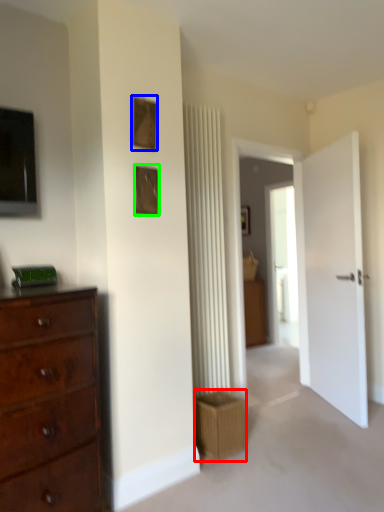
Question: Which object is positioned closest to crate (highlighted by a red box)? Select from picture frame (highlighted by a blue box) and picture frame (highlighted by a green box).

Choices:
 (A) picture frame
 (B) picture frame

Answer: (B)